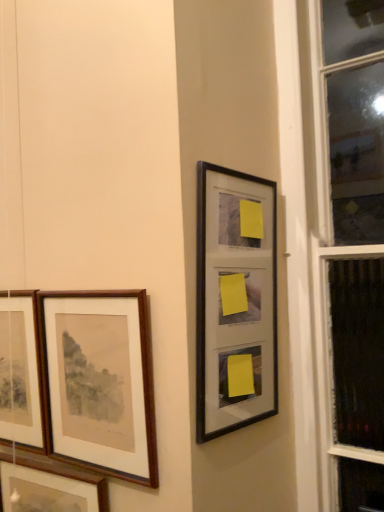
Question: Should I look upward or downward to see wooden frame at left, placed as the second picture frame when sorted from right to left?

Choices:
 (A) down
 (B) up

Answer: (A)

Question: From a real-world perspective, is wooden frame at left, placed as the second picture frame when sorted from right to left, located higher than black matte picture frame at upper right, which is counted as the 1th picture frame, starting from the right?

Choices:
 (A) yes
 (B) no

Answer: (B)

Question: Can black matte picture frame at upper right, which is counted as the 1th picture frame, starting from the right, be found inside wooden frame at left, placed as the second picture frame when sorted from right to left?

Choices:
 (A) yes
 (B) no

Answer: (B)

Question: Considering the relative sizes of wooden frame at left, placed as the second picture frame when sorted from right to left, and black matte picture frame at upper right, the fourth picture frame viewed from the left, in the image provided, is wooden frame at left, placed as the second picture frame when sorted from right to left, bigger than black matte picture frame at upper right, the fourth picture frame viewed from the left,?

Choices:
 (A) yes
 (B) no

Answer: (B)

Question: Can you confirm if wooden frame at left, placed as the 3th picture frame when sorted from left to right, is positioned to the right of black matte picture frame at upper right, which is counted as the 1th picture frame, starting from the right?

Choices:
 (A) no
 (B) yes

Answer: (A)

Question: Can you confirm if wooden frame at left, placed as the second picture frame when sorted from right to left, is thinner than black matte picture frame at upper right, which is counted as the 1th picture frame, starting from the right?

Choices:
 (A) yes
 (B) no

Answer: (A)

Question: Is wooden frame at left, placed as the 3th picture frame when sorted from left to right, positioned beyond the bounds of black matte picture frame at upper right, the fourth picture frame viewed from the left?

Choices:
 (A) no
 (B) yes

Answer: (B)

Question: Are wooden framed picture at left, positioned as the 3th picture frame in right-to-left order, and wooden frame at left, placed as the 3th picture frame when sorted from left to right, making contact?

Choices:
 (A) yes
 (B) no

Answer: (B)

Question: Is wooden framed picture at left, positioned as the 3th picture frame in right-to-left order, facing away from wooden frame at left, placed as the second picture frame when sorted from right to left?

Choices:
 (A) yes
 (B) no

Answer: (B)

Question: Can wooden frame at left, placed as the 3th picture frame when sorted from left to right, be found inside wooden framed picture at left, positioned as the 3th picture frame in right-to-left order?

Choices:
 (A) yes
 (B) no

Answer: (B)

Question: Is wooden framed picture at left, which ranks as the second picture frame in left-to-right order, completely or partially outside of wooden frame at left, placed as the 3th picture frame when sorted from left to right?

Choices:
 (A) no
 (B) yes

Answer: (B)

Question: Can you confirm if wooden framed picture at left, which ranks as the second picture frame in left-to-right order, is taller than wooden frame at left, placed as the second picture frame when sorted from right to left?

Choices:
 (A) yes
 (B) no

Answer: (B)

Question: Does wooden framed picture at left, which ranks as the second picture frame in left-to-right order, have a lesser height compared to wooden frame at left, placed as the second picture frame when sorted from right to left?

Choices:
 (A) no
 (B) yes

Answer: (B)

Question: Is wooden frame at left, placed as the second picture frame when sorted from right to left, behind wooden framed picture at left, which ranks as the second picture frame in left-to-right order?

Choices:
 (A) yes
 (B) no

Answer: (B)